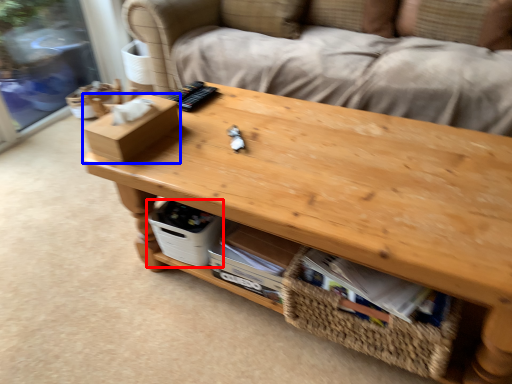
Question: Among these objects, which one is farthest to the camera, storage box (highlighted by a red box) or box (highlighted by a blue box)?

Choices:
 (A) storage box
 (B) box

Answer: (A)